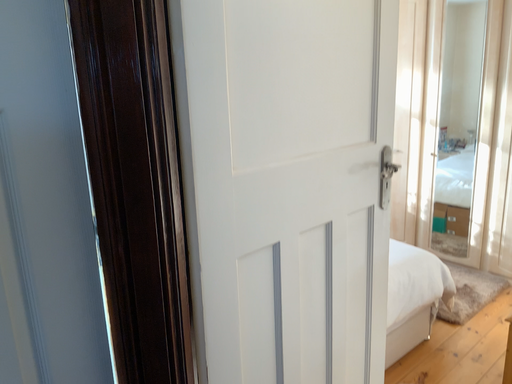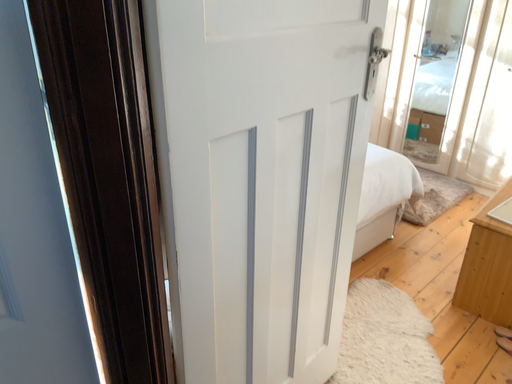
Question: Which way did the camera rotate in the video?

Choices:
 (A) rotated upward
 (B) rotated downward

Answer: (B)